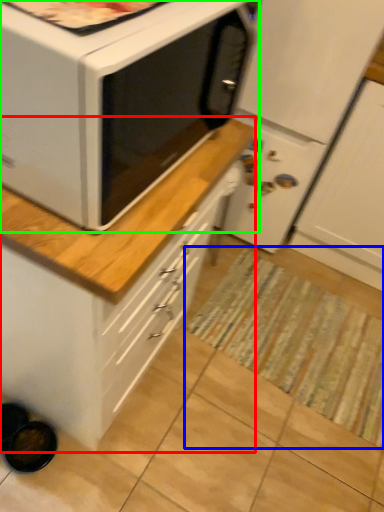
Question: Estimate the real-world distances between objects in this image. Which object is farther from cabinetry (highlighted by a red box), mat (highlighted by a blue box) or microwave oven (highlighted by a green box)?

Choices:
 (A) mat
 (B) microwave oven

Answer: (B)